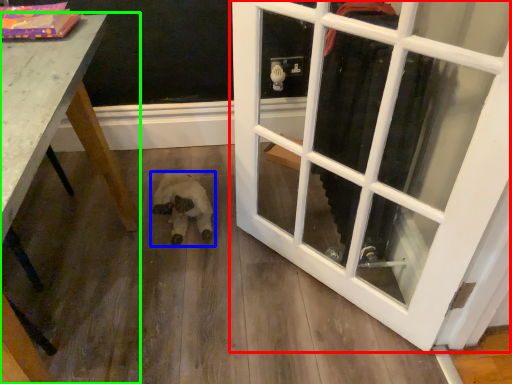
Question: Which object is the farthest from door (highlighted by a red box)? Choose among these: animal (highlighted by a blue box) or table (highlighted by a green box).

Choices:
 (A) animal
 (B) table

Answer: (B)